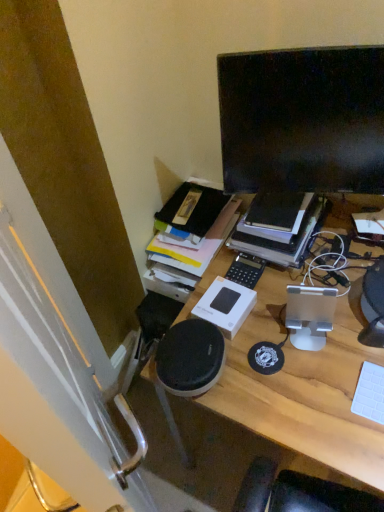
You are a GUI agent. You are given a task and a screenshot of the screen. Output one action in this format:
    pyautogui.click(x=<x>, y=<y>)
    Task: Click on the vacant space situated on the left part of white matte keyboard at right
    
    Given the screenshot: What is the action you would take?
    pyautogui.click(x=329, y=413)